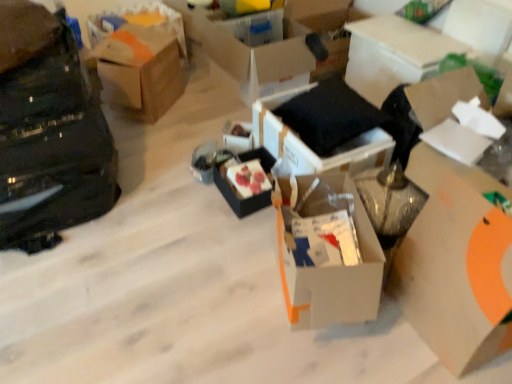
Find the location of a particular element. The width and height of the screenshot is (512, 384). vacant area that is situated to the right of black matte bag at left is located at coordinates (166, 196).